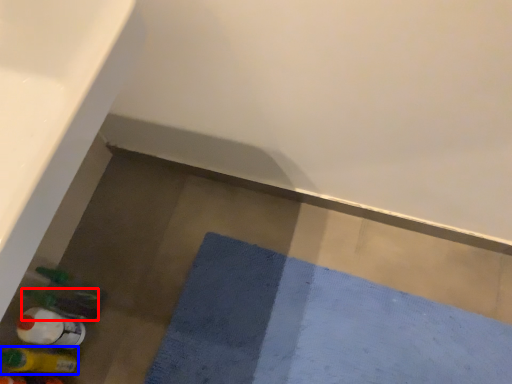
Question: Among these objects, which one is nearest to the camera, bottle (highlighted by a red box) or bottle (highlighted by a blue box)?

Choices:
 (A) bottle
 (B) bottle

Answer: (B)